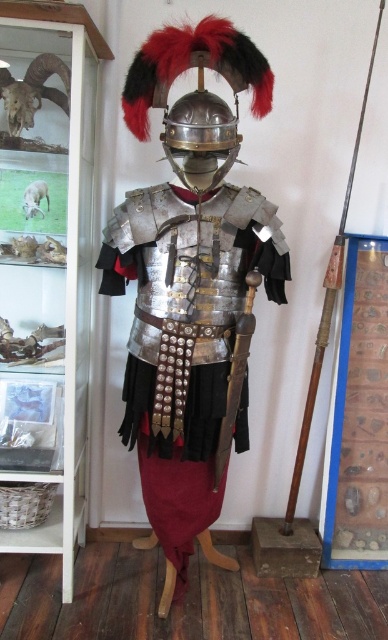
Question: Which object is closer to the camera taking this photo?

Choices:
 (A) metallic sheen sword at center
 (B) white fur sheep at center
 (C) wooden shaft spear at right

Answer: (A)

Question: Does metallic armor at center have a smaller size compared to white fur sheep at center?

Choices:
 (A) yes
 (B) no

Answer: (B)

Question: Is shiny silver helmet at center positioned before wooden shaft spear at right?

Choices:
 (A) no
 (B) yes

Answer: (B)

Question: Among these objects, which one is farthest from the camera?

Choices:
 (A) shiny silver helmet at center
 (B) metallic sheen sword at center

Answer: (B)

Question: Which point is closer to the camera taking this photo?

Choices:
 (A) (159, 195)
 (B) (235, 120)
 (C) (311, 403)
 (D) (223, 451)

Answer: (B)

Question: Is shiny silver helmet at center positioned before white fur sheep at center?

Choices:
 (A) no
 (B) yes

Answer: (B)